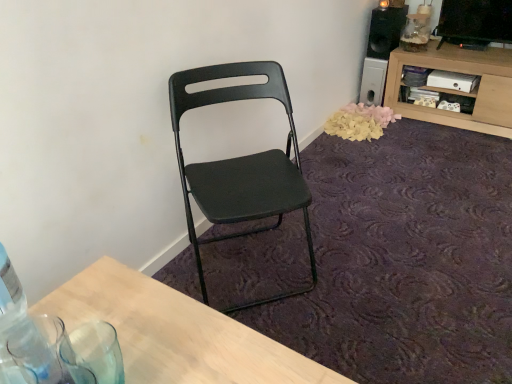
I want to click on vacant area located to the right-hand side of matte black folding chair at center, so click(361, 266).